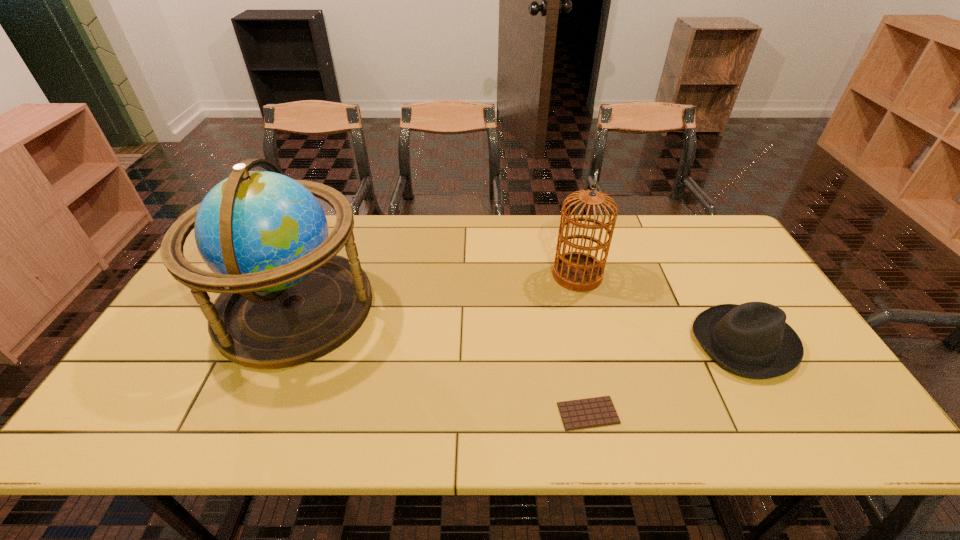
This screenshot has height=540, width=960. I want to click on free space at the near right corner of the desktop, so coord(792,406).

You are a GUI agent. You are given a task and a screenshot of the screen. Output one action in this format:
    pyautogui.click(x=<x>, y=<y>)
    Task: Click on the vacant point located between the globe and the chocolate bar
    The width and height of the screenshot is (960, 540).
    Given the screenshot: What is the action you would take?
    pyautogui.click(x=442, y=360)

Locate an element on the screen. The width and height of the screenshot is (960, 540). empty space between the leftmost object and the nearest object is located at coordinates (442, 360).

You are a GUI agent. You are given a task and a screenshot of the screen. Output one action in this format:
    pyautogui.click(x=<x>, y=<y>)
    Task: Click on the empty location between the fedora and the shortest object
    
    Given the screenshot: What is the action you would take?
    pyautogui.click(x=666, y=378)

At what (x,y) coordinates should I click in order to perform the action: click on free space that is in between the tallest object and the nearest object. Please return your answer as a coordinate pair (x, y). The height and width of the screenshot is (540, 960). Looking at the image, I should click on (442, 360).

At what (x,y) coordinates should I click in order to perform the action: click on vacant space in between the leftmost object and the third shortest object. Please return your answer as a coordinate pair (x, y). Looking at the image, I should click on (436, 291).

At what (x,y) coordinates should I click in order to perform the action: click on vacant area that lies between the shortest object and the second tallest object. Please return your answer as a coordinate pair (x, y). This screenshot has width=960, height=540. Looking at the image, I should click on (583, 344).

Locate an element on the screen. The width and height of the screenshot is (960, 540). vacant area between the birdcage and the fedora is located at coordinates (660, 309).

The height and width of the screenshot is (540, 960). I want to click on blank region between the third tallest object and the tallest object, so click(x=519, y=325).

This screenshot has width=960, height=540. Find the location of `vacant area between the third shortest object and the leftmost object`. vacant area between the third shortest object and the leftmost object is located at coordinates (436, 291).